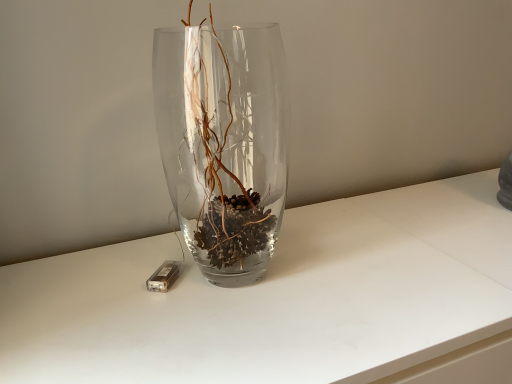
What do you see at coordinates (164, 276) in the screenshot? I see `matte brown rectangular at left` at bounding box center [164, 276].

You are a GUI agent. You are given a task and a screenshot of the screen. Output one action in this format:
    pyautogui.click(x=<x>, y=<y>)
    Task: Click on the matte brown rectangular at left
    The image size is (512, 384).
    Given the screenshot: What is the action you would take?
    pyautogui.click(x=164, y=276)

I want to click on transparent glass vase at center, so click(x=224, y=144).

What do you see at coordinates (224, 144) in the screenshot?
I see `transparent glass vase at center` at bounding box center [224, 144].

Looking at this image, in order to face transparent glass vase at center, should I rotate leftwards or rightwards?

You should look left and rotate roughly 2.984 degrees.

You are a GUI agent. You are given a task and a screenshot of the screen. Output one action in this format:
    pyautogui.click(x=<x>, y=<y>)
    Task: Click on the matte brown rectangular at left
    The width and height of the screenshot is (512, 384).
    Given the screenshot: What is the action you would take?
    pyautogui.click(x=164, y=276)

Does matte brown rectangular at left appear on the right side of transparent glass vase at center?

No.

Considering the relative positions of matte brown rectangular at left and transparent glass vase at center in the image provided, is matte brown rectangular at left in front of transparent glass vase at center?

No, matte brown rectangular at left is further to the viewer.

Is point (149, 282) more distant than point (253, 196)?

No, it is not.

From the image's perspective, between matte brown rectangular at left and transparent glass vase at center, which one is located above?

transparent glass vase at center is shown above in the image.

From a real-world perspective, relative to transparent glass vase at center, is matte brown rectangular at left vertically above or below?

From a real-world perspective, matte brown rectangular at left is physically below transparent glass vase at center.

Considering the sizes of matte brown rectangular at left and transparent glass vase at center in the image, is matte brown rectangular at left wider or thinner than transparent glass vase at center?

Considering their sizes, matte brown rectangular at left looks slimmer than transparent glass vase at center.

In terms of height, does matte brown rectangular at left look taller or shorter compared to transparent glass vase at center?

matte brown rectangular at left is shorter than transparent glass vase at center.

Can you confirm if matte brown rectangular at left is smaller than transparent glass vase at center?

Yes, matte brown rectangular at left is smaller than transparent glass vase at center.

From the picture: Choose the correct answer: Is matte brown rectangular at left inside transparent glass vase at center or outside it?

matte brown rectangular at left lies outside transparent glass vase at center.

Consider the image. Is matte brown rectangular at left far away from transparent glass vase at center?

No, there isn't a large distance between matte brown rectangular at left and transparent glass vase at center.

Is matte brown rectangular at left facing away from transparent glass vase at center?

No, matte brown rectangular at left's orientation is not away from transparent glass vase at center.

Find the location of a particular element. The width and height of the screenshot is (512, 384). vase that appears above the matte brown rectangular at left (from the image's perspective) is located at coordinates (224, 144).

Is transparent glass vase at center at the right side of matte brown rectangular at left?

Yes.

Which object is closer to the camera taking this photo, transparent glass vase at center or matte brown rectangular at left?

transparent glass vase at center is closer to the camera.

Considering the points (267, 65) and (179, 270), which point is in front, point (267, 65) or point (179, 270)?

Positioned in front is point (179, 270).

From the image's perspective, does transparent glass vase at center appear lower than matte brown rectangular at left?

No.

From a real-world perspective, is transparent glass vase at center on matte brown rectangular at left?

Yes, from a real-world perspective, transparent glass vase at center is above matte brown rectangular at left.

Is transparent glass vase at center wider or thinner than matte brown rectangular at left?

Considering their sizes, transparent glass vase at center looks broader than matte brown rectangular at left.

Looking at this image, which of these two, transparent glass vase at center or matte brown rectangular at left, stands shorter?

With less height is matte brown rectangular at left.

Which of these two, transparent glass vase at center or matte brown rectangular at left, is bigger?

transparent glass vase at center.

Does transparent glass vase at center contain matte brown rectangular at left?

No, matte brown rectangular at left is not surrounded by transparent glass vase at center.

Is transparent glass vase at center beside matte brown rectangular at left?

No.

Consider the image. Is matte brown rectangular at left at the back of transparent glass vase at center?

No, transparent glass vase at center is not facing away from matte brown rectangular at left.

This screenshot has height=384, width=512. Identify the location of vase above the matte brown rectangular at left (from a real-world perspective). (224, 144).

Locate an element on the screen. The image size is (512, 384). vase positioned vertically above the matte brown rectangular at left (from a real-world perspective) is located at coordinates (224, 144).

Image resolution: width=512 pixels, height=384 pixels. Find the location of `candle holder that appears below the transparent glass vase at center (from the image's perspective)`. candle holder that appears below the transparent glass vase at center (from the image's perspective) is located at coordinates (164, 276).